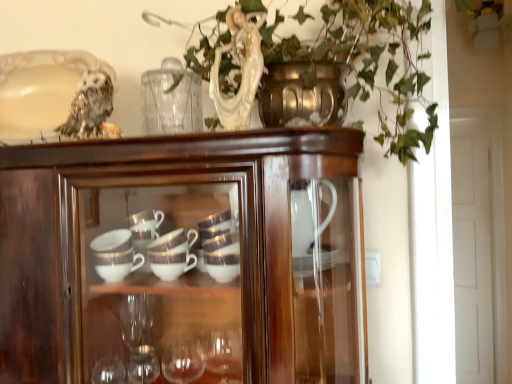
Question: From a real-world perspective, is sparkly silver owl at upper left positioned over white glossy door at right based on gravity?

Choices:
 (A) yes
 (B) no

Answer: (A)

Question: Is the depth of sparkly silver owl at upper left less than that of white glossy door at right?

Choices:
 (A) yes
 (B) no

Answer: (A)

Question: Is sparkly silver owl at upper left not near white glossy door at right?

Choices:
 (A) yes
 (B) no

Answer: (A)

Question: Could you tell me if sparkly silver owl at upper left is turned towards white glossy door at right?

Choices:
 (A) yes
 (B) no

Answer: (B)

Question: Is the position of sparkly silver owl at upper left more distant than that of white glossy door at right?

Choices:
 (A) yes
 (B) no

Answer: (B)

Question: Can you confirm if sparkly silver owl at upper left is shorter than white glossy door at right?

Choices:
 (A) no
 (B) yes

Answer: (B)

Question: Is sparkly silver owl at upper left thinner than glossy wood cupboard at center?

Choices:
 (A) no
 (B) yes

Answer: (B)

Question: Is the depth of sparkly silver owl at upper left less than that of glossy wood cupboard at center?

Choices:
 (A) no
 (B) yes

Answer: (A)

Question: Is sparkly silver owl at upper left not inside glossy wood cupboard at center?

Choices:
 (A) yes
 (B) no

Answer: (A)

Question: From a real-world perspective, is sparkly silver owl at upper left over glossy wood cupboard at center?

Choices:
 (A) no
 (B) yes

Answer: (B)

Question: Considering the relative sizes of sparkly silver owl at upper left and glossy wood cupboard at center in the image provided, is sparkly silver owl at upper left taller than glossy wood cupboard at center?

Choices:
 (A) yes
 (B) no

Answer: (B)

Question: Is sparkly silver owl at upper left touching glossy wood cupboard at center?

Choices:
 (A) no
 (B) yes

Answer: (A)

Question: Does glossy wood cupboard at center have a greater width compared to sparkly silver owl at upper left?

Choices:
 (A) yes
 (B) no

Answer: (A)